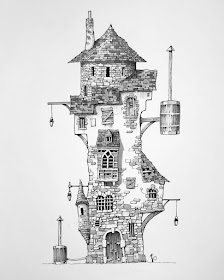
I want to click on window, so click(150, 193).